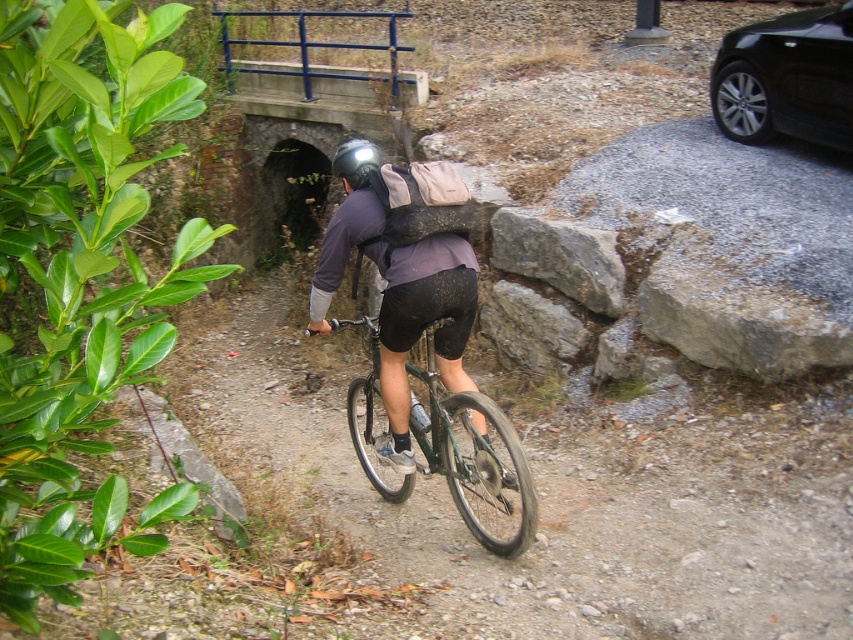
You are a cyclist on the path and want to check your helmet. Which object, the green matte bicycle at center or the matte black helmet at center, is closer to you?

The green matte bicycle at center is closer to you than the matte black helmet at center.

You are standing at the starting point of the path and want to reach a specific point marked at coordinates point (485, 509). If your walking speed is 1.5 meters per second, how many seconds will it take you to reach that point?

The distance to point (485, 509) is 4.42 meters. At a speed of 1.5 meters per second, it will take approximately 2.95 seconds to reach the point.

You are a cyclist planning to ride through this path. You notice the green matte bicycle at center and the matte black helmet at center. Which object is closer to the ground?

The green matte bicycle at center is positioned under the matte black helmet at center, so the green matte bicycle at center is closer to the ground.